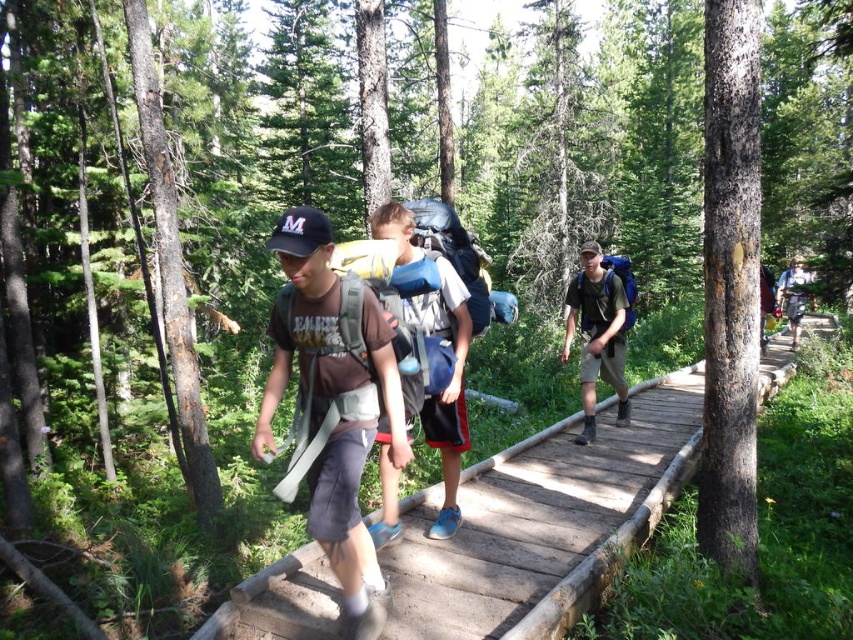
You are a hiker carrying a matte gray backpack at center and want to cross the wooden bridge at center. Can you safely walk across the bridge while carrying the backpack?

The wooden bridge at center is shorter than the matte gray backpack at center, so the bridge may not be long enough to support the backpack properly. It is recommended to check the bridge for stability before attempting to cross while carrying the backpack.

You are a hiker carrying a matte green backpack at center and need to cross the wooden bridge at center. Is the distance between them sufficient for you to reach the bridge without needing to adjust your position?

The wooden bridge at center and matte green backpack at center are 3.39 meters apart from each other. Since the distance is manageable for a hiker to walk, you can reach the bridge without needing to adjust your position.

You are a hiker carrying a matte green backpack at center and need to cross the wooden bridge at center. Based on their heights, can you safely step onto the bridge without bending down?

The wooden bridge at center has a lesser height compared to matte green backpack at center. Since the bridge is lower, you can step onto it easily without needing to bend down.